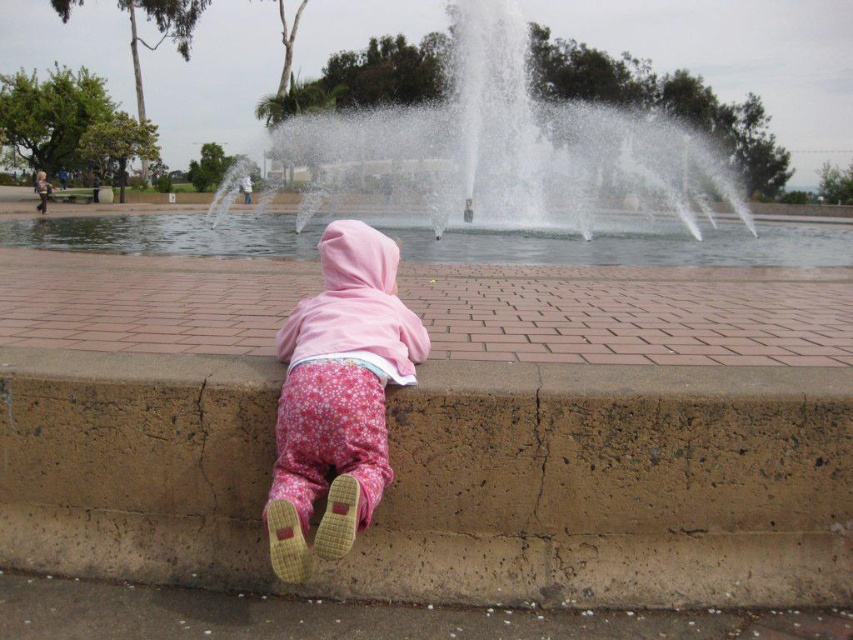
Question: Which object is the farthest from the white water at center?

Choices:
 (A) brown concrete curb at lower center
 (B) pink fleece jacket at center

Answer: (B)

Question: Based on their relative distances, which object is farther from the white water at center?

Choices:
 (A) clear water at center
 (B) pink fleece jacket at center

Answer: (B)

Question: Does brown concrete curb at lower center appear under pink fleece jacket at center?

Choices:
 (A) no
 (B) yes

Answer: (B)

Question: Considering the real-world distances, which object is closest to the clear water at center?

Choices:
 (A) pink fleece jacket at center
 (B) brown concrete curb at lower center
 (C) white water at center

Answer: (C)

Question: Does white water at center have a smaller size compared to pink fleece jacket at center?

Choices:
 (A) no
 (B) yes

Answer: (A)

Question: Does brown concrete curb at lower center appear over clear water at center?

Choices:
 (A) yes
 (B) no

Answer: (B)